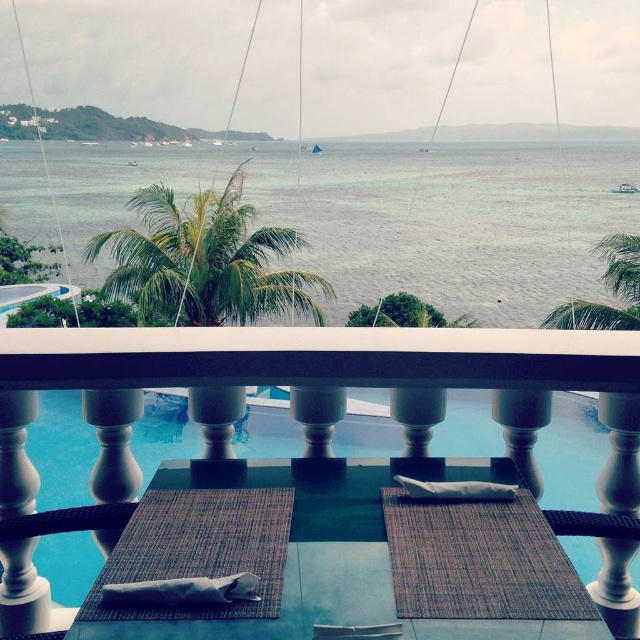
Is greenish-blue water at center to the left of bamboo placemat at center from the viewer's perspective?

Correct, you'll find greenish-blue water at center to the left of bamboo placemat at center.

Is point (166, 170) positioned after point (445, 556)?

Yes, point (166, 170) is behind point (445, 556).

Identify the location of greenish-blue water at center. The height and width of the screenshot is (640, 640). (451, 221).

Where is `greenish-blue water at center`? The height and width of the screenshot is (640, 640). greenish-blue water at center is located at coordinates (451, 221).

Does white matte table at center appear on the left side of bamboo placemat at center?

Yes, white matte table at center is to the left of bamboo placemat at center.

Can you confirm if white matte table at center is taller than bamboo placemat at center?

Indeed, white matte table at center has a greater height compared to bamboo placemat at center.

Does point (227, 625) come closer to viewer compared to point (435, 540)?

Yes, it is.

Where is `white matte table at center`? The width and height of the screenshot is (640, 640). white matte table at center is located at coordinates (324, 483).

Between point (541, 595) and point (412, 228), which one is positioned behind?

Point (412, 228)

Does white matte table at center have a smaller size compared to greenish-blue water at center?

Yes, white matte table at center is smaller than greenish-blue water at center.

Measure the distance between point (356, 513) and camera.

Point (356, 513) is 1.40 meters from camera.

This screenshot has width=640, height=640. Find the location of `white matte table at center`. white matte table at center is located at coordinates (324, 483).